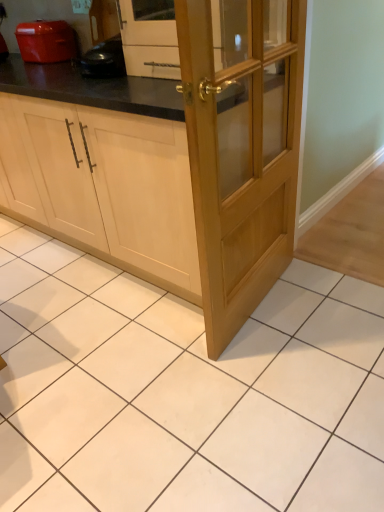
Question: In terms of height, does light wood cabinet at center look taller or shorter compared to matte orange toaster at upper left?

Choices:
 (A) tall
 (B) short

Answer: (A)

Question: Considering the positions of light wood cabinet at center and matte orange toaster at upper left in the image, is light wood cabinet at center wider or thinner than matte orange toaster at upper left?

Choices:
 (A) wide
 (B) thin

Answer: (A)

Question: Based on their relative distances, which object is nearer to the light wood/glass door at center?

Choices:
 (A) matte orange toaster at upper left
 (B) light wood cabinet at center

Answer: (B)

Question: Estimate the real-world distances between objects in this image. Which object is closer to the matte orange toaster at upper left?

Choices:
 (A) light wood cabinet at center
 (B) light wood/glass door at center

Answer: (A)